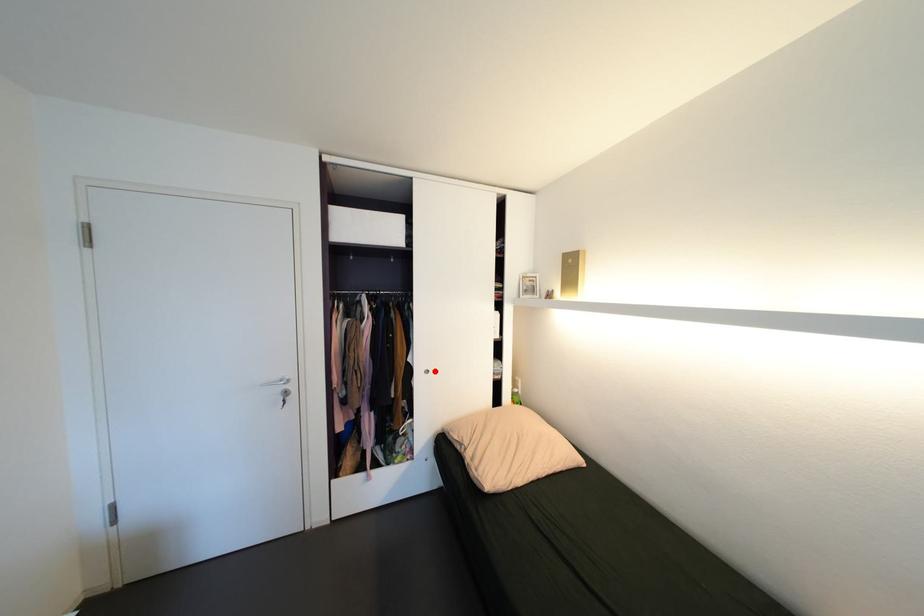
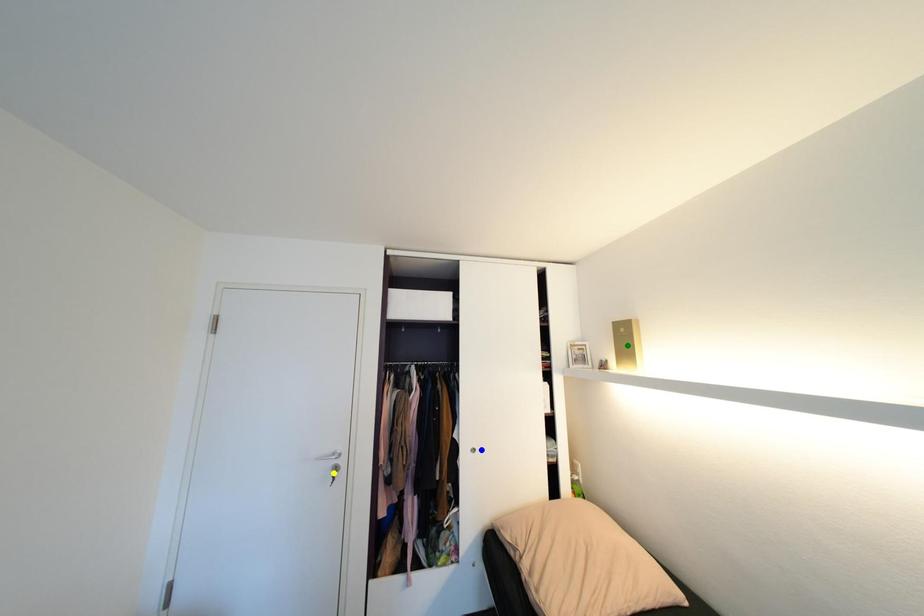
Question: I am providing you with two images of the same scene from different viewpoints. A red point is marked on the first image. You are given multiple points on the second image. Which mark in image 2 goes with the point in image 1?

Choices:
 (A) yellow point
 (B) green point
 (C) blue point

Answer: (C)